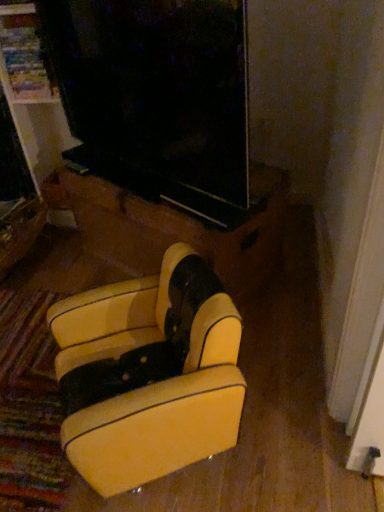
What is the approximate width of yellow leather armchair at lower center, which ranks as the second furniture in back-to-front order?

The width of yellow leather armchair at lower center, which ranks as the second furniture in back-to-front order, is 19.60 inches.

Where is `leather armchair at center, which is the second furniture from front to back`? leather armchair at center, which is the second furniture from front to back is located at coordinates (176, 228).

Is yellow leather armchair at lower center, which ranks as the second furniture in back-to-front order, not near leather armchair at center, which is the first furniture in back-to-front order?

Actually, yellow leather armchair at lower center, which ranks as the second furniture in back-to-front order, and leather armchair at center, which is the first furniture in back-to-front order, are a little close together.

Is yellow leather armchair at lower center, the 1th furniture viewed from the front, inside or outside of leather armchair at center, which is the first furniture in back-to-front order?

A: yellow leather armchair at lower center, the 1th furniture viewed from the front, is outside leather armchair at center, which is the first furniture in back-to-front order.

Considering the positions of point (231, 352) and point (128, 274), is point (231, 352) closer or farther from the camera than point (128, 274)?

Clearly, point (231, 352) is closer to the camera than point (128, 274).

Between yellow leather armchair at lower center, the 1th furniture viewed from the front, and leather armchair at center, which is the second furniture from front to back, which one has smaller size?

yellow leather armchair at lower center, the 1th furniture viewed from the front, is smaller.

Is point (41, 216) closer or farther from the camera than point (112, 397)?

Point (41, 216) is farther from the camera than point (112, 397).

Which object is further away from the camera taking this photo, wooden drawer at lower left or yellow leather armchair at lower center, the 1th furniture viewed from the front?

wooden drawer at lower left.

Looking at the image, does wooden drawer at lower left seem bigger or smaller compared to yellow leather armchair at lower center, the 1th furniture viewed from the front?

Clearly, wooden drawer at lower left is smaller in size than yellow leather armchair at lower center, the 1th furniture viewed from the front.

Which object is wider, wooden drawer at lower left or yellow leather armchair at lower center, the 1th furniture viewed from the front?

Wider between the two is wooden drawer at lower left.

Which of these two, leather armchair at center, which is the first furniture in back-to-front order, or wooden drawer at lower left, is bigger?

leather armchair at center, which is the first furniture in back-to-front order.

From the image's perspective, is leather armchair at center, which is the second furniture from front to back, under wooden drawer at lower left?

No, from the image's perspective, leather armchair at center, which is the second furniture from front to back, is not below wooden drawer at lower left.

Consider the image. Which object is positioned more to the left, leather armchair at center, which is the first furniture in back-to-front order, or wooden drawer at lower left?

wooden drawer at lower left.

Which is nearer, (25, 254) or (222, 274)?

Point (25, 254) is farther from the camera than point (222, 274).

From a real-world perspective, is wooden drawer at lower left physically located above or below leather armchair at center, which is the second furniture from front to back?

wooden drawer at lower left is below leather armchair at center, which is the second furniture from front to back.

Is wooden drawer at lower left positioned with its back to leather armchair at center, which is the first furniture in back-to-front order?

No, wooden drawer at lower left is not facing away from leather armchair at center, which is the first furniture in back-to-front order.

Considering the relative positions of wooden drawer at lower left and leather armchair at center, which is the first furniture in back-to-front order, in the image provided, is wooden drawer at lower left to the left or to the right of leather armchair at center, which is the first furniture in back-to-front order,?

From the image, it's evident that wooden drawer at lower left is to the left of leather armchair at center, which is the first furniture in back-to-front order.

Does point (265, 180) lie in front of point (80, 410)?

No.

From a real-world perspective, does leather armchair at center, which is the second furniture from front to back, stand above yellow leather armchair at lower center, which ranks as the second furniture in back-to-front order?

No, from a real-world perspective, leather armchair at center, which is the second furniture from front to back, is not over yellow leather armchair at lower center, which ranks as the second furniture in back-to-front order

Considering the relative sizes of leather armchair at center, which is the second furniture from front to back, and yellow leather armchair at lower center, the 1th furniture viewed from the front, in the image provided, is leather armchair at center, which is the second furniture from front to back, thinner than yellow leather armchair at lower center, the 1th furniture viewed from the front,?

Incorrect, the width of leather armchair at center, which is the second furniture from front to back, is not less than that of yellow leather armchair at lower center, the 1th furniture viewed from the front.

Where is `furniture located behind the yellow leather armchair at lower center, which ranks as the second furniture in back-to-front order`? The image size is (384, 512). furniture located behind the yellow leather armchair at lower center, which ranks as the second furniture in back-to-front order is located at coordinates (176, 228).

Does yellow leather armchair at lower center, which ranks as the second furniture in back-to-front order, have a greater height compared to wooden drawer at lower left?

Yes, yellow leather armchair at lower center, which ranks as the second furniture in back-to-front order, is taller than wooden drawer at lower left.

Is yellow leather armchair at lower center, which ranks as the second furniture in back-to-front order, to the left or to the right of wooden drawer at lower left in the image?

yellow leather armchair at lower center, which ranks as the second furniture in back-to-front order, is to the right of wooden drawer at lower left.

From the image's perspective, does yellow leather armchair at lower center, the 1th furniture viewed from the front, appear lower than wooden drawer at lower left?

Indeed, from the image's perspective, yellow leather armchair at lower center, the 1th furniture viewed from the front, is shown beneath wooden drawer at lower left.

Considering their positions, is yellow leather armchair at lower center, which ranks as the second furniture in back-to-front order, located in front of or behind wooden drawer at lower left?

Clearly, yellow leather armchair at lower center, which ranks as the second furniture in back-to-front order, is in front of wooden drawer at lower left.

Identify the location of furniture in front of the leather armchair at center, which is the second furniture from front to back. (149, 374).

Where is `furniture below the wooden drawer at lower left (from the image's perspective)`? This screenshot has width=384, height=512. furniture below the wooden drawer at lower left (from the image's perspective) is located at coordinates (149, 374).

Based on their spatial positions, is wooden drawer at lower left or yellow leather armchair at lower center, the 1th furniture viewed from the front, further from leather armchair at center, which is the first furniture in back-to-front order?

The object further to leather armchair at center, which is the first furniture in back-to-front order, is wooden drawer at lower left.

When comparing their distances from yellow leather armchair at lower center, which ranks as the second furniture in back-to-front order, does wooden drawer at lower left or leather armchair at center, which is the first furniture in back-to-front order, seem closer?

Among the two, leather armchair at center, which is the first furniture in back-to-front order, is located nearer to yellow leather armchair at lower center, which ranks as the second furniture in back-to-front order.

Based on their spatial positions, is yellow leather armchair at lower center, the 1th furniture viewed from the front, or wooden drawer at lower left closer to leather armchair at center, which is the second furniture from front to back?

Based on the image, yellow leather armchair at lower center, the 1th furniture viewed from the front, appears to be nearer to leather armchair at center, which is the second furniture from front to back.

Based on their spatial positions, is leather armchair at center, which is the second furniture from front to back, or wooden drawer at lower left further from yellow leather armchair at lower center, the 1th furniture viewed from the front?

wooden drawer at lower left is positioned further to the anchor yellow leather armchair at lower center, the 1th furniture viewed from the front.

In the scene shown: Which object lies further to the anchor point wooden drawer at lower left, yellow leather armchair at lower center, which ranks as the second furniture in back-to-front order, or leather armchair at center, which is the first furniture in back-to-front order?

yellow leather armchair at lower center, which ranks as the second furniture in back-to-front order, lies further to wooden drawer at lower left than the other object.

When comparing their distances from wooden drawer at lower left, does leather armchair at center, which is the second furniture from front to back, or yellow leather armchair at lower center, the 1th furniture viewed from the front, seem further?

yellow leather armchair at lower center, the 1th furniture viewed from the front, lies further to wooden drawer at lower left than the other object.

The width and height of the screenshot is (384, 512). In order to click on furniture between yellow leather armchair at lower center, which ranks as the second furniture in back-to-front order, and wooden drawer at lower left from front to back in this screenshot , I will do `click(176, 228)`.